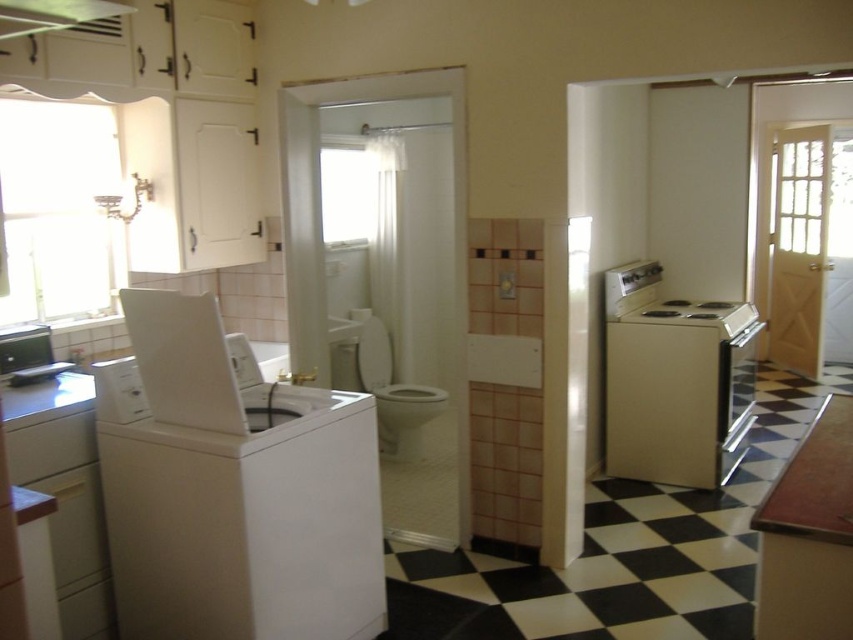
Question: Does white matte washing machine at left come in front of white matte washing machine at center?

Choices:
 (A) yes
 (B) no

Answer: (A)

Question: Which point is farther to the camera?

Choices:
 (A) (386, 422)
 (B) (152, 326)

Answer: (A)

Question: Can you confirm if white matte washing machine at left is smaller than white glossy toilet bowl at center?

Choices:
 (A) yes
 (B) no

Answer: (B)

Question: Can you confirm if white matte washing machine at left is positioned below white matte washing machine at center?

Choices:
 (A) no
 (B) yes

Answer: (B)

Question: Which object is the farthest from the white glossy toilet bowl at center?

Choices:
 (A) white matte washing machine at center
 (B) white matte washing machine at left

Answer: (B)

Question: Which object is the closest to the white glossy toilet bowl at center?

Choices:
 (A) white matte washing machine at left
 (B) white matte washing machine at center

Answer: (B)